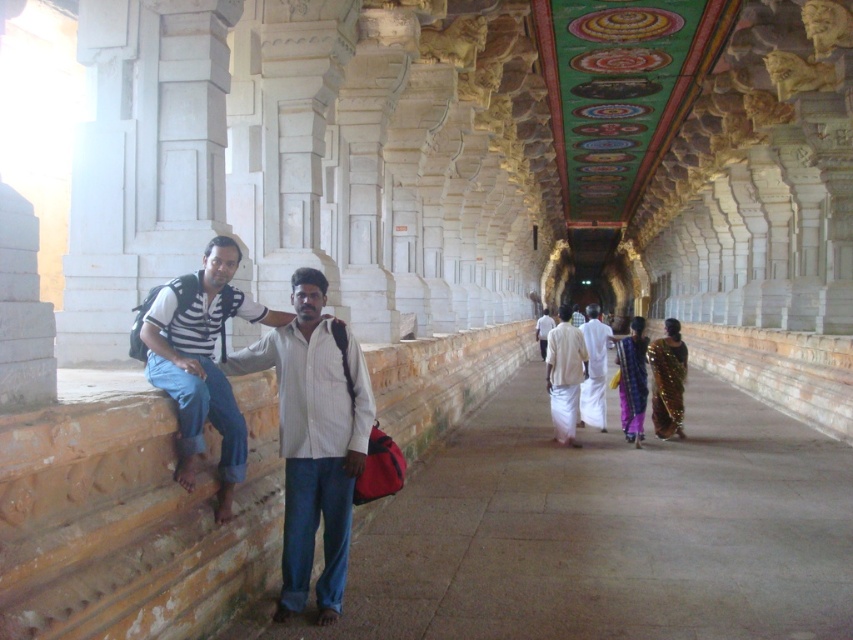
Does white cotton dhoti at center appear over light brown fabric shirt at center?

No, white cotton dhoti at center is not above light brown fabric shirt at center.

Who is taller, white cotton dhoti at center or light brown fabric shirt at center?

light brown fabric shirt at center is taller.

Which is in front, point (601, 369) or point (541, 346)?

Point (601, 369) is in front.

This screenshot has width=853, height=640. In order to click on white cotton dhoti at center in this screenshot , I will do [595, 369].

I want to click on white cotton shirt at center, so click(314, 440).

From the picture: Is white cotton shirt at center above light beige cotton dhoti at center?

Correct, white cotton shirt at center is located above light beige cotton dhoti at center.

Between point (287, 584) and point (560, 305), which one is positioned in front?

Point (287, 584)

I want to click on white cotton shirt at center, so click(314, 440).

Does light beige cotton dhoti at center come behind white cotton dhoti at center?

No, it is in front of white cotton dhoti at center.

Can you confirm if light beige cotton dhoti at center is wider than white cotton dhoti at center?

Indeed, light beige cotton dhoti at center has a greater width compared to white cotton dhoti at center.

This screenshot has height=640, width=853. What do you see at coordinates (564, 376) in the screenshot?
I see `light beige cotton dhoti at center` at bounding box center [564, 376].

The image size is (853, 640). I want to click on light beige cotton dhoti at center, so click(564, 376).